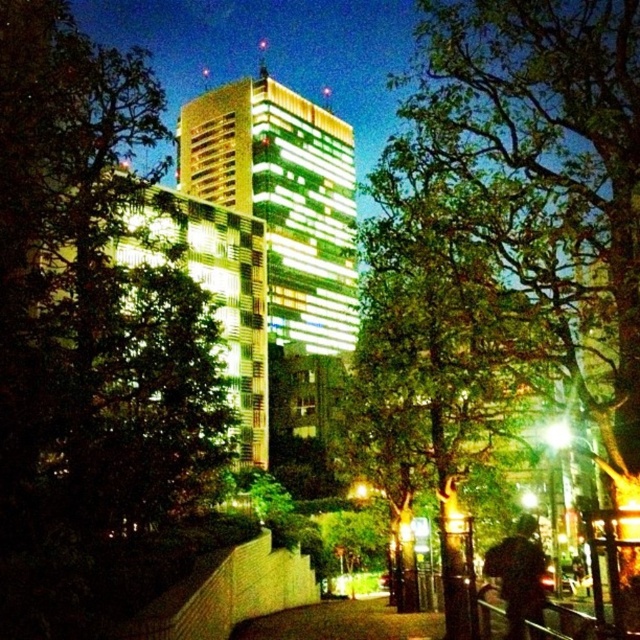
Looking at this image, who is taller, green leafy tree at center or dark concrete sidewalk at center?

Standing taller between the two is green leafy tree at center.

Who is higher up, green leafy tree at center or dark concrete sidewalk at center?

Positioned higher is green leafy tree at center.

The height and width of the screenshot is (640, 640). I want to click on green leafy tree at center, so [90, 344].